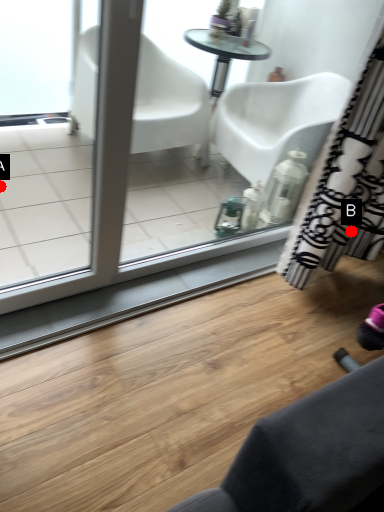
Question: Two points are circled on the image, labeled by A and B beside each circle. Which of the following is the closest to the observer?

Choices:
 (A) A is closer
 (B) B is closer

Answer: (B)